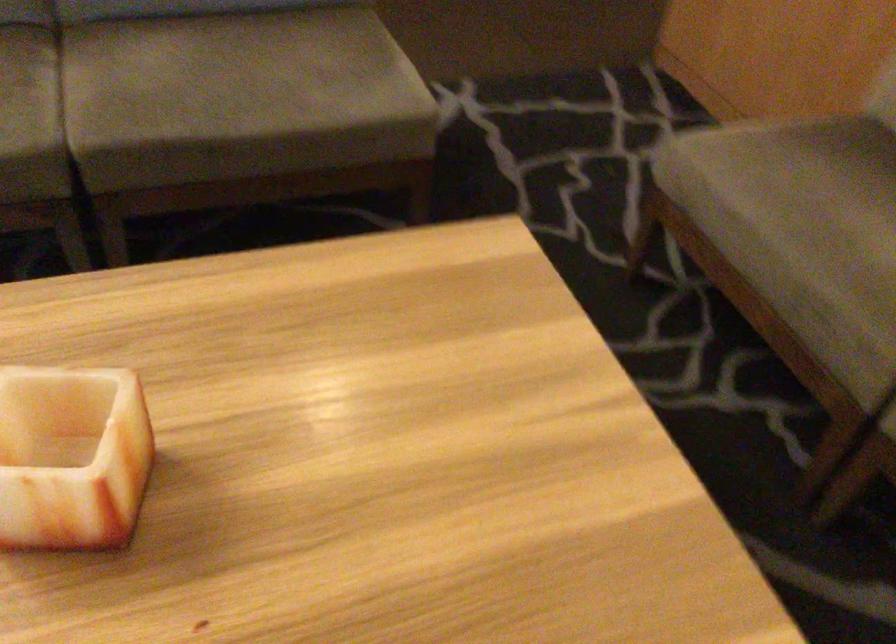
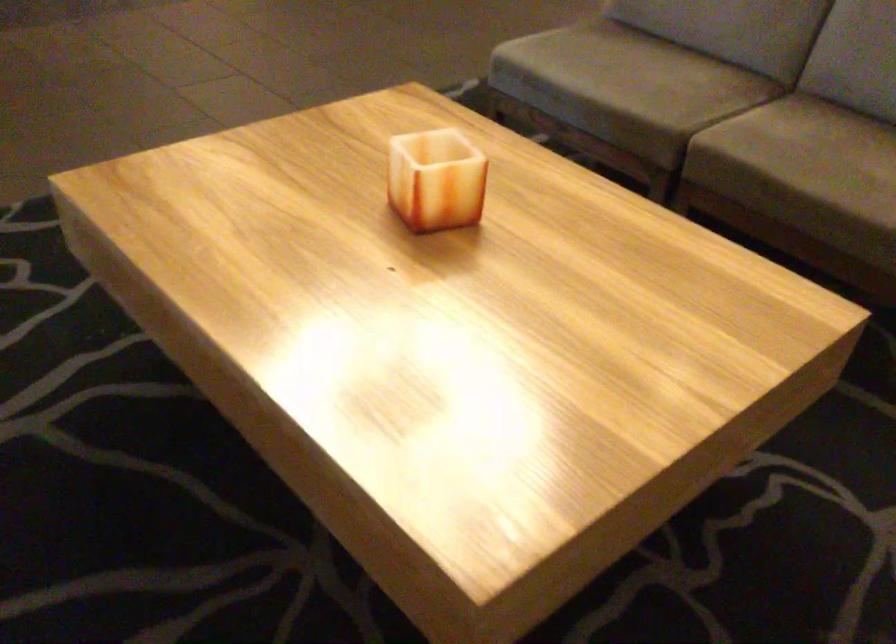
Question: The camera is either moving clockwise (left) or counter-clockwise (right) around the object. The first image is from the beginning of the video and the second image is from the end. Is the camera moving left or right when shooting the video?

Choices:
 (A) Left
 (B) Right

Answer: (B)